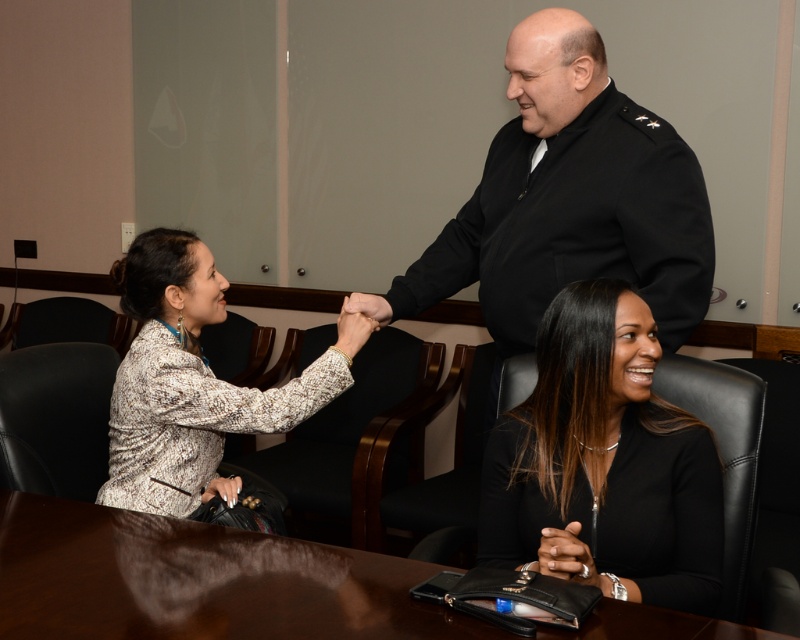
Does brown wooden table at lower center have a lesser height compared to patterned fabric blouse at left?

Yes, brown wooden table at lower center is shorter than patterned fabric blouse at left.

Can you confirm if brown wooden table at lower center is taller than patterned fabric blouse at left?

No, brown wooden table at lower center is not taller than patterned fabric blouse at left.

Between point (244, 616) and point (140, 346), which one is positioned behind?

Positioned behind is point (140, 346).

At what (x,y) coordinates should I click in order to perform the action: click on brown wooden table at lower center. Please return your answer as a coordinate pair (x, y). This screenshot has width=800, height=640. Looking at the image, I should click on (197, 580).

Is black leather chair at lower right further to the viewer compared to brown wooden table at lower center?

Yes.

Based on the photo, between black leather chair at lower right and brown wooden table at lower center, which one has more height?

black leather chair at lower right

Is point (574, 380) farther from camera compared to point (94, 545)?

No.

The height and width of the screenshot is (640, 800). I want to click on black leather chair at lower right, so (x=604, y=461).

Is black leather chair at lower right in front of patterned fabric blouse at left?

Yes, it is.

Describe the element at coordinates (604, 461) in the screenshot. Image resolution: width=800 pixels, height=640 pixels. I see `black leather chair at lower right` at that location.

Is point (570, 428) farther from viewer compared to point (252, 404)?

No, it is in front of (252, 404).

You are a GUI agent. You are given a task and a screenshot of the screen. Output one action in this format:
    pyautogui.click(x=<x>, y=<y>)
    Task: Click on the black leather chair at lower right
    
    Given the screenshot: What is the action you would take?
    pyautogui.click(x=604, y=461)